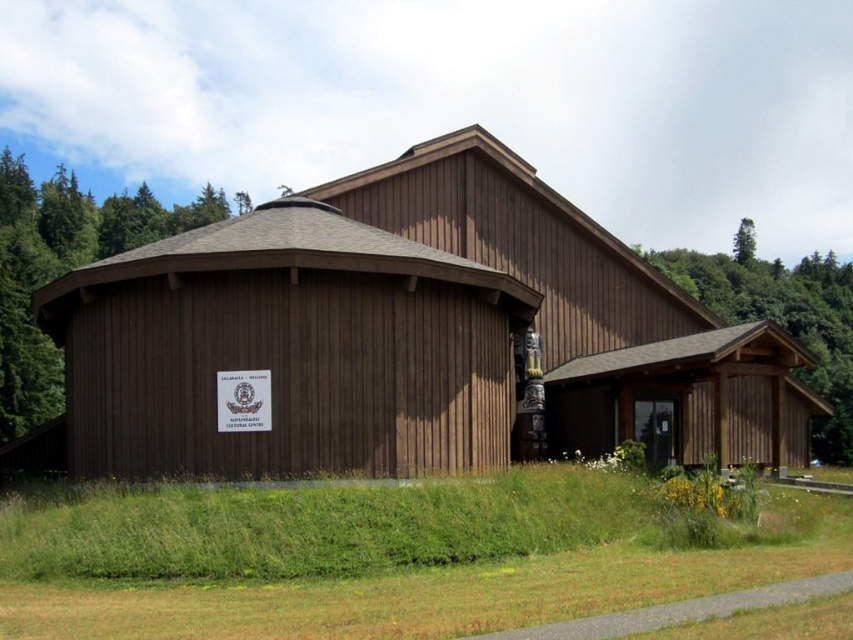
Question: Can you confirm if brown wooden barn at center is positioned to the left of green wood tree at left?

Choices:
 (A) no
 (B) yes

Answer: (A)

Question: Which point is farther to the camera?

Choices:
 (A) (32, 243)
 (B) (788, 316)
 (C) (813, 360)

Answer: (B)

Question: Does green wood tree at center appear on the right side of green leafy tree at upper right?

Choices:
 (A) no
 (B) yes

Answer: (A)

Question: Which object appears farthest from the camera in this image?

Choices:
 (A) brown wooden barn at center
 (B) green leafy tree at upper right

Answer: (B)

Question: Which object is farther from the camera taking this photo?

Choices:
 (A) green wood tree at center
 (B) brown wooden barn at center
 (C) green leafy tree at upper right

Answer: (C)

Question: Is green wood tree at left positioned at the back of green wood tree at center?

Choices:
 (A) no
 (B) yes

Answer: (B)